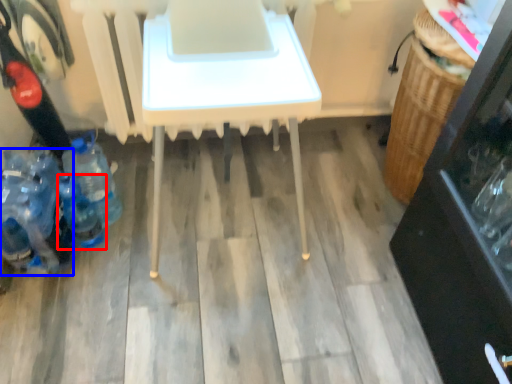
Question: Among these objects, which one is nearest to the camera, bottle (highlighted by a red box) or bottle (highlighted by a blue box)?

Choices:
 (A) bottle
 (B) bottle

Answer: (B)